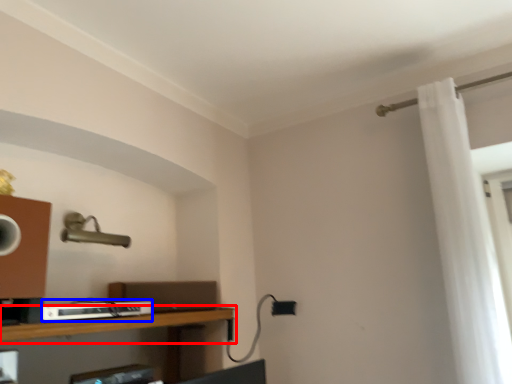
Question: Which of the following is the closest to the observer, shelf (highlighted by a red box) or equipment (highlighted by a blue box)?

Choices:
 (A) shelf
 (B) equipment

Answer: (A)